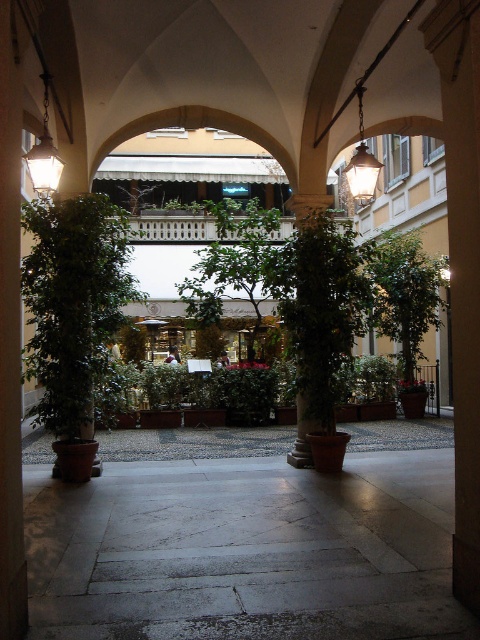
Question: Does green leafy tree at center lie in front of matte white lamp at upper left?

Choices:
 (A) no
 (B) yes

Answer: (A)

Question: Which point is closer to the camera taking this photo?

Choices:
 (A) (374, 184)
 (B) (45, 177)
 (C) (267, 236)

Answer: (B)

Question: Is green leafy tree at center smaller than matte brass lantern at upper center?

Choices:
 (A) yes
 (B) no

Answer: (B)

Question: Based on their relative distances, which object is farther from the matte brass lantern at upper center?

Choices:
 (A) green leafy tree at center
 (B) matte white lamp at upper left

Answer: (A)

Question: Which point is closer to the camera taking this photo?

Choices:
 (A) (44, 164)
 (B) (361, 118)
 (C) (224, 259)

Answer: (A)

Question: Is green leafy tree at center smaller than matte brass lantern at upper center?

Choices:
 (A) yes
 (B) no

Answer: (B)